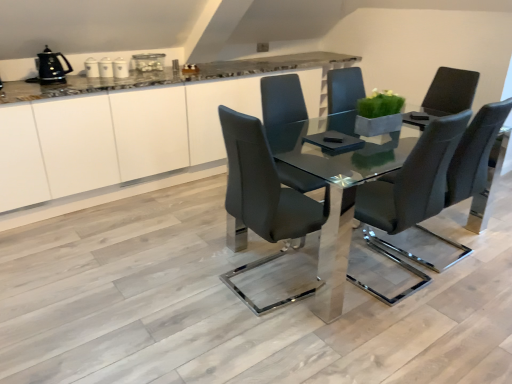
Where is `vacant space that's between matte black chair at center, arranged as the first chair when viewed from the left, and clear glass table at center`? vacant space that's between matte black chair at center, arranged as the first chair when viewed from the left, and clear glass table at center is located at coordinates (258, 288).